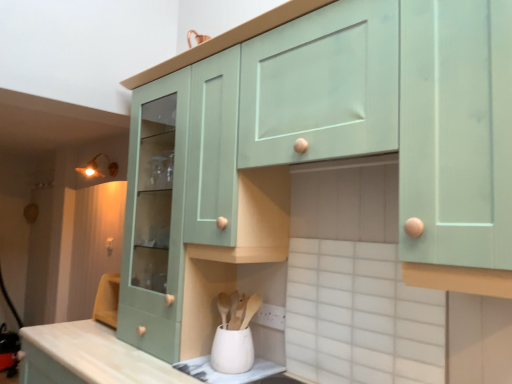
Describe the element at coordinates (234, 251) in the screenshot. This screenshot has height=384, width=512. I see `mint green wood cabinet at upper center, acting as the 1th cabinetry starting from the right` at that location.

You are a GUI agent. You are given a task and a screenshot of the screen. Output one action in this format:
    pyautogui.click(x=<x>, y=<y>)
    Task: Click on the white ceramic tile at lower center
    
    Given the screenshot: What is the action you would take?
    pyautogui.click(x=360, y=316)

Is the position of matte brass light fixture at upper left less distant than that of white matte utensil holder at lower center?

No, the depth of matte brass light fixture at upper left is greater than that of white matte utensil holder at lower center.

Which is farther, (97, 170) or (251, 344)?

The point (97, 170) is farther.

Who is smaller, matte brass light fixture at upper left or white matte utensil holder at lower center?

Smaller between the two is white matte utensil holder at lower center.

This screenshot has width=512, height=384. I want to click on cabinetry that is below the mint green wood cabinet at upper center, the second cabinetry viewed from the left (from the image's perspective), so click(155, 218).

Between mint green wood cabinet at center, positioned as the second cabinetry in right-to-left order, and mint green wood cabinet at upper center, the second cabinetry viewed from the left, which one appears on the left side from the viewer's perspective?

From the viewer's perspective, mint green wood cabinet at center, positioned as the second cabinetry in right-to-left order, appears more on the left side.

Which of these two, mint green wood cabinet at center, the 1th cabinetry in the left-to-right sequence, or mint green wood cabinet at upper center, the second cabinetry viewed from the left, is wider?

mint green wood cabinet at center, the 1th cabinetry in the left-to-right sequence, is wider.

Does white ceramic tile at lower center have a greater height compared to white matte utensil holder at lower center?

Indeed, white ceramic tile at lower center has a greater height compared to white matte utensil holder at lower center.

From the image's perspective, is white ceramic tile at lower center below white matte utensil holder at lower center?

No, from the image's perspective, white ceramic tile at lower center is not below white matte utensil holder at lower center.

Considering the positions of objects white ceramic tile at lower center and white matte utensil holder at lower center in the image provided, who is in front, white ceramic tile at lower center or white matte utensil holder at lower center?

white ceramic tile at lower center.

Is matte brass light fixture at upper left oriented away from white ceramic tile at lower center?

matte brass light fixture at upper left is not turned away from white ceramic tile at lower center.

Is matte brass light fixture at upper left to the left of white ceramic tile at lower center from the viewer's perspective?

Indeed, matte brass light fixture at upper left is positioned on the left side of white ceramic tile at lower center.

From a real-world perspective, is matte brass light fixture at upper left positioned above or below white ceramic tile at lower center?

Clearly, from a real-world perspective, matte brass light fixture at upper left is above white ceramic tile at lower center.

Is white ceramic tile at lower center surrounded by matte brass light fixture at upper left?

No, white ceramic tile at lower center is not inside matte brass light fixture at upper left.

How many degrees apart are the facing directions of mint green wood cabinet at upper center, acting as the 1th cabinetry starting from the right, and matte brass light fixture at upper left?

They differ by 8.42 degrees in their facing directions.

Considering the points (455, 270) and (89, 164), which point is behind, point (455, 270) or point (89, 164)?

The point (89, 164) is farther.

Considering the positions of objects mint green wood cabinet at upper center, the second cabinetry viewed from the left, and matte brass light fixture at upper left in the image provided, who is in front, mint green wood cabinet at upper center, the second cabinetry viewed from the left, or matte brass light fixture at upper left?

mint green wood cabinet at upper center, the second cabinetry viewed from the left.

Considering the sizes of mint green wood cabinet at upper center, acting as the 1th cabinetry starting from the right, and matte brass light fixture at upper left in the image, is mint green wood cabinet at upper center, acting as the 1th cabinetry starting from the right, wider or thinner than matte brass light fixture at upper left?

Considering their sizes, mint green wood cabinet at upper center, acting as the 1th cabinetry starting from the right, looks broader than matte brass light fixture at upper left.

Measure the distance from matte brass light fixture at upper left to mint green wood cabinet at upper center, acting as the 1th cabinetry starting from the right.

6.22 feet.

Is matte brass light fixture at upper left looking in the opposite direction of mint green wood cabinet at upper center, acting as the 1th cabinetry starting from the right?

No, mint green wood cabinet at upper center, acting as the 1th cabinetry starting from the right, is not at the back of matte brass light fixture at upper left.

Considering the positions of objects matte brass light fixture at upper left and mint green wood cabinet at upper center, the second cabinetry viewed from the left, in the image provided, who is more to the left, matte brass light fixture at upper left or mint green wood cabinet at upper center, the second cabinetry viewed from the left,?

matte brass light fixture at upper left.

What's the angular difference between matte brass light fixture at upper left and mint green wood cabinet at upper center, the second cabinetry viewed from the left,'s facing directions?

The facing directions of matte brass light fixture at upper left and mint green wood cabinet at upper center, the second cabinetry viewed from the left, are 8.42 degrees apart.

From a real-world perspective, is white matte utensil holder at lower center located beneath matte brass light fixture at upper left?

Yes.

Who is more distant, white matte utensil holder at lower center or matte brass light fixture at upper left?

matte brass light fixture at upper left is more distant.

In the scene shown: Does white matte utensil holder at lower center have a greater width compared to matte brass light fixture at upper left?

In fact, white matte utensil holder at lower center might be narrower than matte brass light fixture at upper left.

Is white matte utensil holder at lower center positioned far away from matte brass light fixture at upper left?

white matte utensil holder at lower center is far away from matte brass light fixture at upper left.

The height and width of the screenshot is (384, 512). Identify the location of appliance below the matte brass light fixture at upper left (from a real-world perspective). (232, 350).

Image resolution: width=512 pixels, height=384 pixels. What are the coordinates of `cabinetry above the mint green wood cabinet at center, the 1th cabinetry in the left-to-right sequence (from a real-world perspective)` in the screenshot? It's located at (234, 251).

Based on their spatial positions, is matte brass light fixture at upper left or white matte utensil holder at lower center closer to mint green wood cabinet at upper center, acting as the 1th cabinetry starting from the right?

Based on the image, white matte utensil holder at lower center appears to be nearer to mint green wood cabinet at upper center, acting as the 1th cabinetry starting from the right.

From the picture: Looking at the image, which one is located further to white ceramic tile at lower center, mint green wood cabinet at upper center, the second cabinetry viewed from the left, or mint green wood cabinet at center, the 1th cabinetry in the left-to-right sequence?

Based on the image, mint green wood cabinet at center, the 1th cabinetry in the left-to-right sequence, appears to be further to white ceramic tile at lower center.

Which object lies further to the anchor point white ceramic tile at lower center, mint green wood cabinet at upper center, the second cabinetry viewed from the left, or matte brass light fixture at upper left?

matte brass light fixture at upper left is positioned further to the anchor white ceramic tile at lower center.

Estimate the real-world distances between objects in this image. Which object is further from white matte utensil holder at lower center, mint green wood cabinet at center, positioned as the second cabinetry in right-to-left order, or matte brass light fixture at upper left?

matte brass light fixture at upper left lies further to white matte utensil holder at lower center than the other object.

From the image, which object appears to be farther from mint green wood cabinet at upper center, acting as the 1th cabinetry starting from the right, mint green wood cabinet at center, positioned as the second cabinetry in right-to-left order, or white ceramic tile at lower center?

mint green wood cabinet at center, positioned as the second cabinetry in right-to-left order, is positioned further to the anchor mint green wood cabinet at upper center, acting as the 1th cabinetry starting from the right.

Which object lies further to the anchor point white matte utensil holder at lower center, white ceramic tile at lower center or mint green wood cabinet at upper center, acting as the 1th cabinetry starting from the right?

Based on the image, white ceramic tile at lower center appears to be further to white matte utensil holder at lower center.

Looking at the image, which one is located closer to white ceramic tile at lower center, white matte utensil holder at lower center or mint green wood cabinet at upper center, acting as the 1th cabinetry starting from the right?

Among the two, mint green wood cabinet at upper center, acting as the 1th cabinetry starting from the right, is located nearer to white ceramic tile at lower center.

Which object lies further to the anchor point mint green wood cabinet at upper center, the second cabinetry viewed from the left, matte brass light fixture at upper left or mint green wood cabinet at center, positioned as the second cabinetry in right-to-left order?

Among the two, matte brass light fixture at upper left is located further to mint green wood cabinet at upper center, the second cabinetry viewed from the left.

This screenshot has width=512, height=384. Identify the location of ceramic tile that lies between mint green wood cabinet at upper center, acting as the 1th cabinetry starting from the right, and white matte utensil holder at lower center from top to bottom. (360, 316).

Where is `appliance positioned between mint green wood cabinet at upper center, acting as the 1th cabinetry starting from the right, and mint green wood cabinet at center, positioned as the second cabinetry in right-to-left order, from near to far`? appliance positioned between mint green wood cabinet at upper center, acting as the 1th cabinetry starting from the right, and mint green wood cabinet at center, positioned as the second cabinetry in right-to-left order, from near to far is located at coordinates (232, 350).

You are a GUI agent. You are given a task and a screenshot of the screen. Output one action in this format:
    pyautogui.click(x=<x>, y=<y>)
    Task: Click on the appliance between white ceramic tile at lower center and matte brass light fixture at upper left along the z-axis
    Image resolution: width=512 pixels, height=384 pixels.
    Given the screenshot: What is the action you would take?
    pyautogui.click(x=232, y=350)

You are a GUI agent. You are given a task and a screenshot of the screen. Output one action in this format:
    pyautogui.click(x=<x>, y=<y>)
    Task: Click on the ceramic tile located between mint green wood cabinet at upper center, the second cabinetry viewed from the left, and mint green wood cabinet at center, the 1th cabinetry in the left-to-right sequence, in the depth direction
    The width and height of the screenshot is (512, 384).
    Given the screenshot: What is the action you would take?
    pyautogui.click(x=360, y=316)